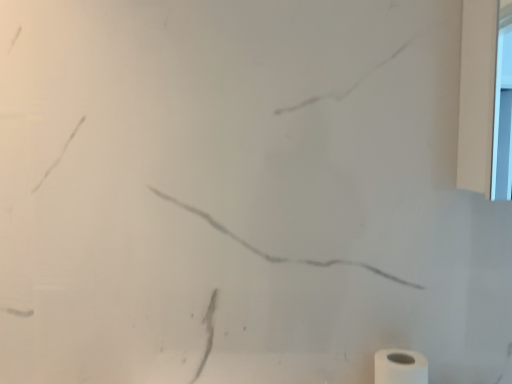
What do you see at coordinates (400, 367) in the screenshot? The width and height of the screenshot is (512, 384). I see `white matte toilet paper at lower right` at bounding box center [400, 367].

Where is `white matte toilet paper at lower right`? white matte toilet paper at lower right is located at coordinates (400, 367).

Locate an element on the screen. white matte toilet paper at lower right is located at coordinates (400, 367).